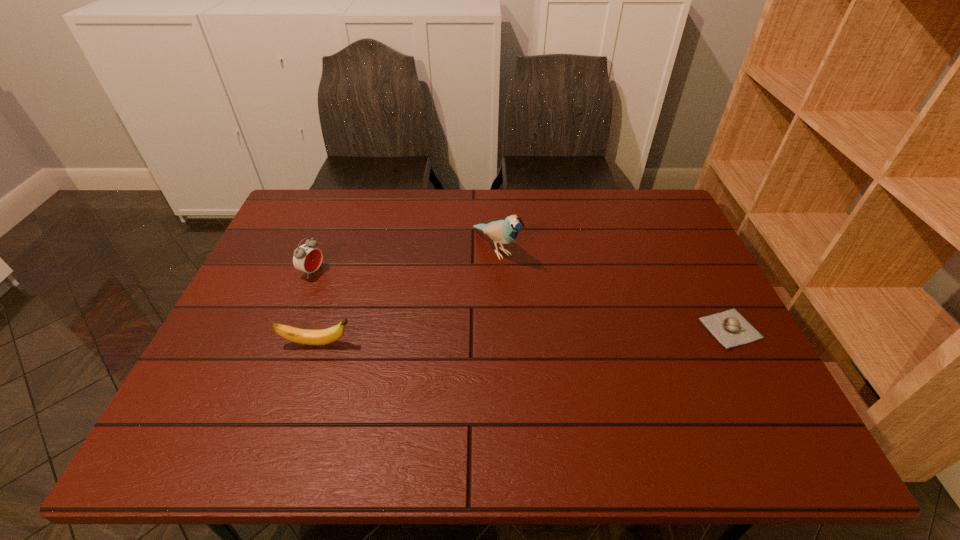
Where is `vacant space at the left edge of the desktop`? vacant space at the left edge of the desktop is located at coordinates (274, 274).

Locate an element on the screen. free space at the right edge is located at coordinates (733, 349).

In the image, there is a desktop. In order to click on blank space at the far left corner in this screenshot , I will do `click(290, 231)`.

This screenshot has height=540, width=960. Find the location of `free region at the near left corner of the desktop`. free region at the near left corner of the desktop is located at coordinates (246, 388).

Find the location of a particular element. The width and height of the screenshot is (960, 540). vacant space that is in between the alarm clock and the tallest object is located at coordinates (404, 260).

The width and height of the screenshot is (960, 540). Find the location of `vacant area that lies between the tallest object and the third tallest object`. vacant area that lies between the tallest object and the third tallest object is located at coordinates click(406, 296).

The height and width of the screenshot is (540, 960). What are the coordinates of `free spot between the second shortest object and the alarm clock` in the screenshot? It's located at pos(315,308).

Identify the location of free space between the tallest object and the alarm clock. (404, 260).

At what (x,y) coordinates should I click in order to perform the action: click on free point between the alarm clock and the banana. Please return your answer as a coordinate pair (x, y). Image resolution: width=960 pixels, height=540 pixels. Looking at the image, I should click on (315, 308).

This screenshot has height=540, width=960. Identify the location of free spot between the shortest object and the tallest object. (612, 288).